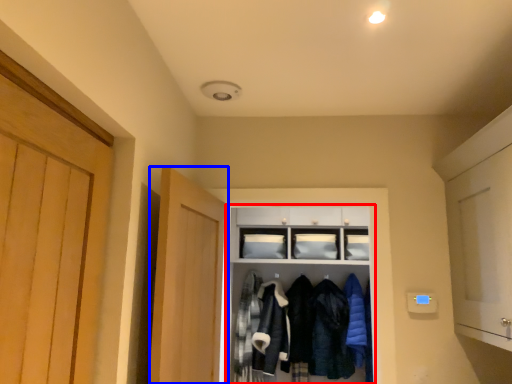
Question: Which of the following is the closest to the observer, cabinetry (highlighted by a red box) or door (highlighted by a blue box)?

Choices:
 (A) cabinetry
 (B) door

Answer: (B)